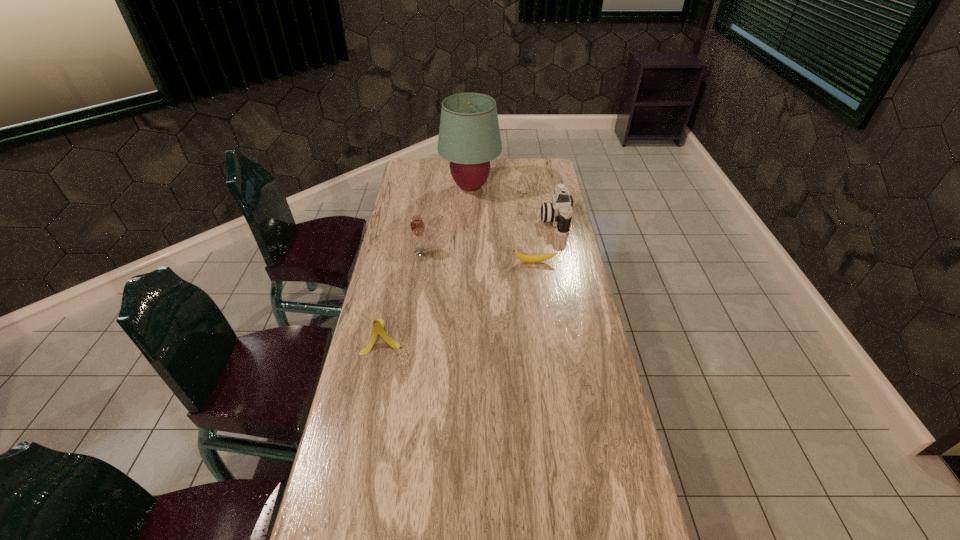
Find the location of a particular element. Image resolution: width=960 pixels, height=540 pixels. free space at the right edge of the desktop is located at coordinates (530, 218).

You are a GUI agent. You are given a task and a screenshot of the screen. Output one action in this format:
    pyautogui.click(x=<x>, y=<y>)
    Task: Click on the vacant point located between the third farthest object and the camera
    
    Given the screenshot: What is the action you would take?
    point(488,236)

The width and height of the screenshot is (960, 540). What are the coordinates of `vacant point located between the lampshade and the shortest object` in the screenshot? It's located at (502, 225).

At what (x,y) coordinates should I click in order to perform the action: click on free spot between the shortest object and the wineglass. Please return your answer as a coordinate pair (x, y). Looking at the image, I should click on (477, 257).

This screenshot has width=960, height=540. Identify the location of free space between the right banana and the third object from left to right. (502, 225).

You are a GUI agent. You are given a task and a screenshot of the screen. Output one action in this format:
    pyautogui.click(x=<x>, y=<y>)
    Task: Click on the empty location between the tallest object and the fourth shortest object
    This screenshot has height=540, width=960.
    Given the screenshot: What is the action you would take?
    pyautogui.click(x=445, y=220)

Identify the location of empty space that is in between the shorter banana and the left banana. (459, 299).

Locate an element on the screen. This screenshot has width=960, height=540. free spot between the second tallest object and the second shortest object is located at coordinates (402, 295).

Identify the location of free space between the lampshade and the third farthest object. This screenshot has height=540, width=960. (445, 220).

Where is `free space that is in between the camera and the fourth shortest object`? free space that is in between the camera and the fourth shortest object is located at coordinates (488, 236).